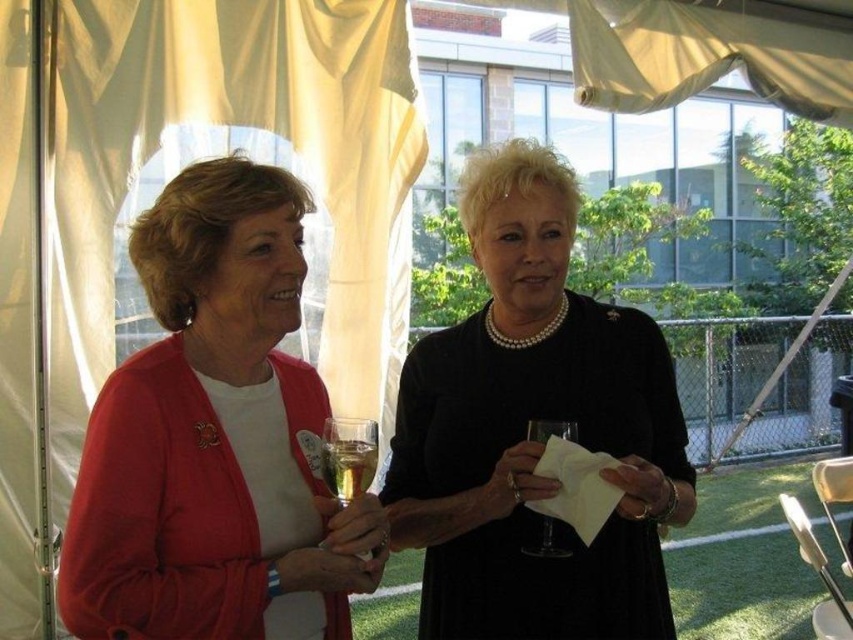
You are a photographer at a social event holding a camera. You want to take a photo of the matte red cardigan at center without moving your position. Can you do it?

The matte red cardigan at center and camera are 3.41 feet apart, so yes, you can take a photo of the matte red cardigan at center from your current position as the distance is sufficient.

You are at a social event and see two women under a tent. The woman on the left is holding a glass of champagne and a small card, while the woman on the right holds a glass and a white napkin. There is a point marked at coordinates (215, 438). Based on the scene, what object is located at that point?

The point at coordinates (215, 438) marks the location of the matte red cardigan at center.